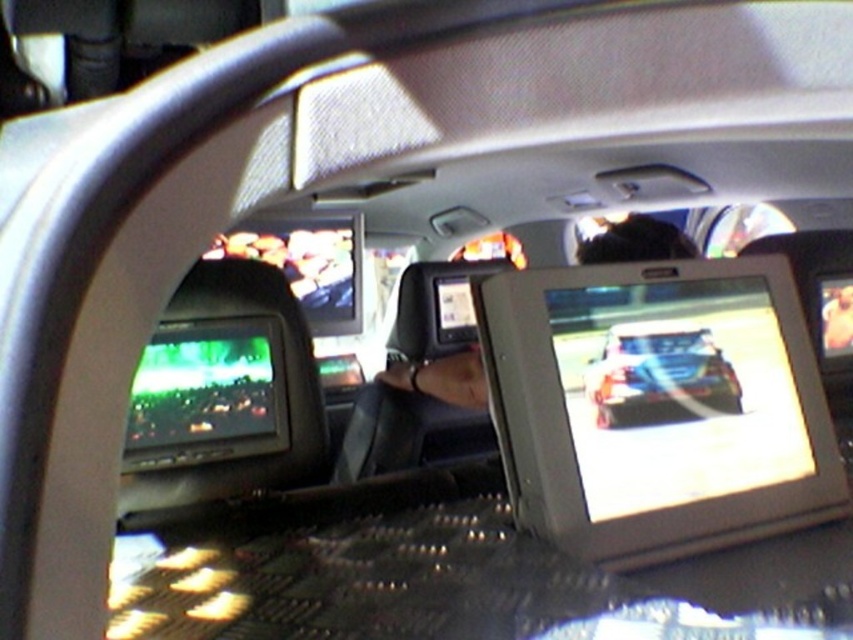
Measure the distance between shiny plastic screen at center and matte black monitor at center.

shiny plastic screen at center and matte black monitor at center are 28.42 inches apart.

Which is above, shiny plastic screen at center or matte black monitor at center?

shiny plastic screen at center

Describe the element at coordinates (675, 392) in the screenshot. I see `shiny plastic screen at center` at that location.

The width and height of the screenshot is (853, 640). What are the coordinates of `shiny plastic screen at center` in the screenshot? It's located at (675, 392).

Is shiny metallic car at center taller than matte black monitor at center?

In fact, shiny metallic car at center may be shorter than matte black monitor at center.

How far apart are shiny metallic car at center and matte black monitor at center?

The distance of shiny metallic car at center from matte black monitor at center is 30.41 inches.

Find the location of a particular element. This screenshot has width=853, height=640. shiny metallic car at center is located at coordinates (659, 376).

Who is shorter, shiny plastic screen at center or shiny metallic car at center?

shiny metallic car at center is shorter.

I want to click on shiny plastic screen at center, so click(675, 392).

Where is `shiny plastic screen at center`? The width and height of the screenshot is (853, 640). shiny plastic screen at center is located at coordinates (675, 392).